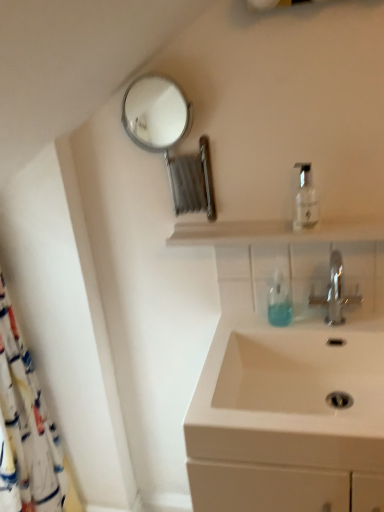
Question: Does metallic circular mirror at upper left have a smaller size compared to white fabric shower curtain at left?

Choices:
 (A) no
 (B) yes

Answer: (B)

Question: Can you confirm if metallic circular mirror at upper left is taller than white fabric shower curtain at left?

Choices:
 (A) no
 (B) yes

Answer: (A)

Question: From the image's perspective, is metallic circular mirror at upper left located beneath white fabric shower curtain at left?

Choices:
 (A) yes
 (B) no

Answer: (B)

Question: Can you see metallic circular mirror at upper left touching white fabric shower curtain at left?

Choices:
 (A) yes
 (B) no

Answer: (B)

Question: Can we say metallic circular mirror at upper left lies outside white fabric shower curtain at left?

Choices:
 (A) yes
 (B) no

Answer: (A)

Question: Is translucent plastic soap dispenser at center inside or outside of clear plastic bottle at upper right?

Choices:
 (A) outside
 (B) inside

Answer: (A)

Question: Is translucent plastic soap dispenser at center in front of or behind clear plastic bottle at upper right in the image?

Choices:
 (A) front
 (B) behind

Answer: (B)

Question: From the image's perspective, is translucent plastic soap dispenser at center located above or below clear plastic bottle at upper right?

Choices:
 (A) above
 (B) below

Answer: (B)

Question: Is translucent plastic soap dispenser at center to the left or to the right of clear plastic bottle at upper right in the image?

Choices:
 (A) left
 (B) right

Answer: (A)

Question: Relative to silver metallic faucet at center, is white ceramic sink at lower right in front or behind?

Choices:
 (A) front
 (B) behind

Answer: (A)

Question: Does point (226, 402) appear closer or farther from the camera than point (337, 297)?

Choices:
 (A) closer
 (B) farther

Answer: (A)

Question: Would you say white ceramic sink at lower right is to the left or to the right of silver metallic faucet at center in the picture?

Choices:
 (A) right
 (B) left

Answer: (B)

Question: Looking at the image, does white ceramic sink at lower right seem bigger or smaller compared to silver metallic faucet at center?

Choices:
 (A) big
 (B) small

Answer: (A)

Question: From a real-world perspective, is metallic circular mirror at upper left physically located above or below transparent glass shelf at center?

Choices:
 (A) below
 (B) above

Answer: (B)

Question: From the image's perspective, is metallic circular mirror at upper left above or below transparent glass shelf at center?

Choices:
 (A) above
 (B) below

Answer: (A)